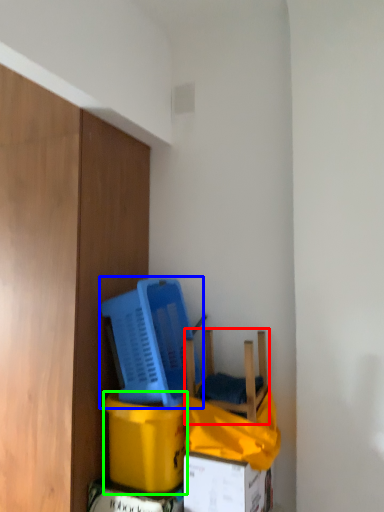
Question: Which is farther away from chair (highlighted by a red box)? basket (highlighted by a blue box) or cardboard box (highlighted by a green box)?

Choices:
 (A) basket
 (B) cardboard box

Answer: (B)